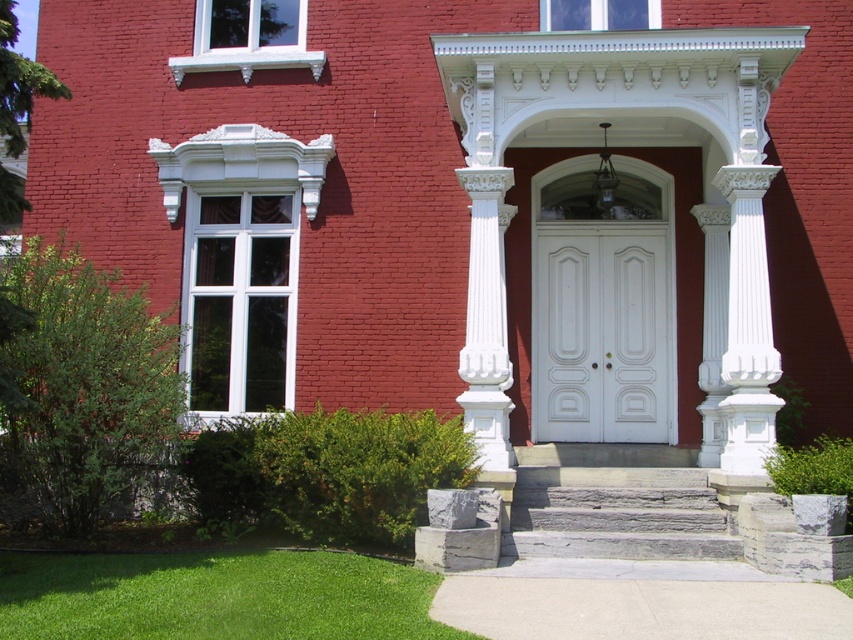
Question: Is green grass at lower left behind gray stone stairs at center?

Choices:
 (A) yes
 (B) no

Answer: (B)

Question: Can you confirm if white smooth door at center is thinner than gray stone stairs at center?

Choices:
 (A) yes
 (B) no

Answer: (A)

Question: Which of the following is the farthest from the observer?

Choices:
 (A) (163, 621)
 (B) (544, 228)
 (C) (531, 513)

Answer: (B)

Question: Which point is closer to the camera?

Choices:
 (A) white smooth door at center
 (B) green grass at lower left
 (C) gray stone stairs at center

Answer: (B)

Question: Is green grass at lower left to the left of gray stone stairs at center from the viewer's perspective?

Choices:
 (A) yes
 (B) no

Answer: (A)

Question: Which point appears farthest from the camera in this image?

Choices:
 (A) (206, 621)
 (B) (535, 481)

Answer: (B)